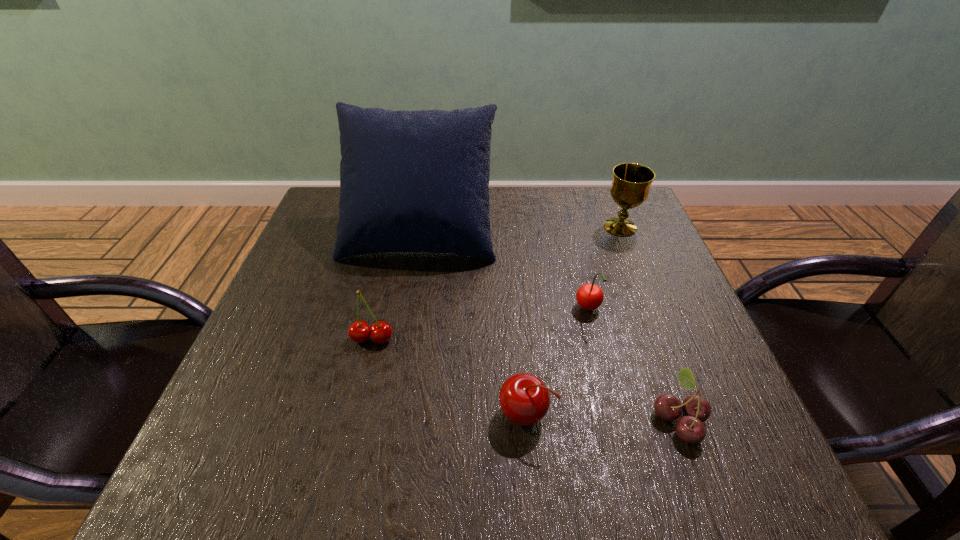
You are a GUI agent. You are given a task and a screenshot of the screen. Output one action in this format:
    pyautogui.click(x=<x>, y=<y>)
    Task: Click on the tallest object
    Image resolution: width=960 pixels, height=540 pixels.
    Given the screenshot: What is the action you would take?
    (x=410, y=181)

Where is `the fifth shortest object`? The width and height of the screenshot is (960, 540). the fifth shortest object is located at coordinates (630, 188).

In order to click on the third object from right to left in this screenshot , I will do `click(589, 296)`.

Identify the location of the third cherry from left to right. (589, 296).

Find the location of `the second farthest cherry`. the second farthest cherry is located at coordinates (381, 332).

Where is `the leftmost cherry`? the leftmost cherry is located at coordinates (381, 332).

What are the coordinates of `the third cherry from right to left` in the screenshot? It's located at (524, 398).

This screenshot has width=960, height=540. Identify the location of the rightmost cherry. (696, 409).

This screenshot has width=960, height=540. In order to click on the shortest object in this screenshot , I will do `click(696, 409)`.

I want to click on vacant area situated 0.210m on the facing side of the cushion, so click(403, 333).